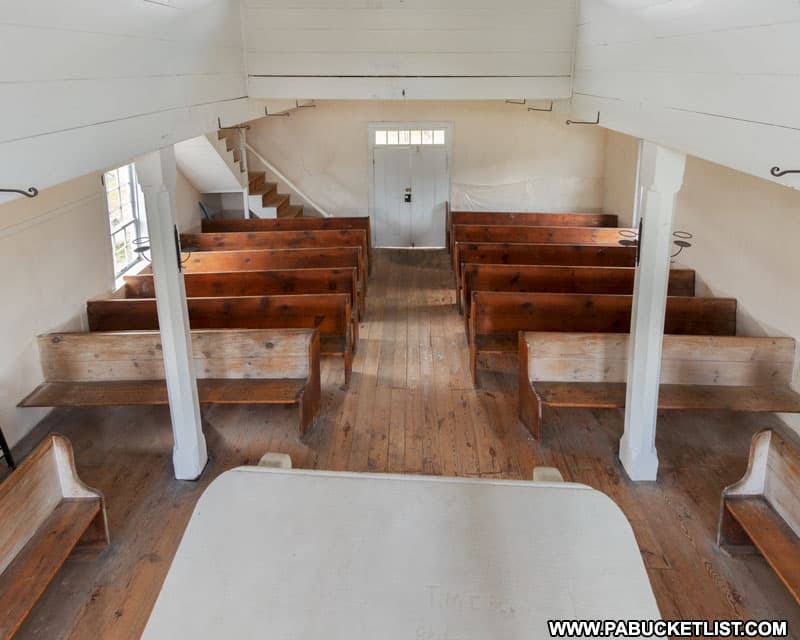
Where is `candle holder`? The width and height of the screenshot is (800, 640). candle holder is located at coordinates (637, 249), (677, 237), (182, 248), (141, 251).